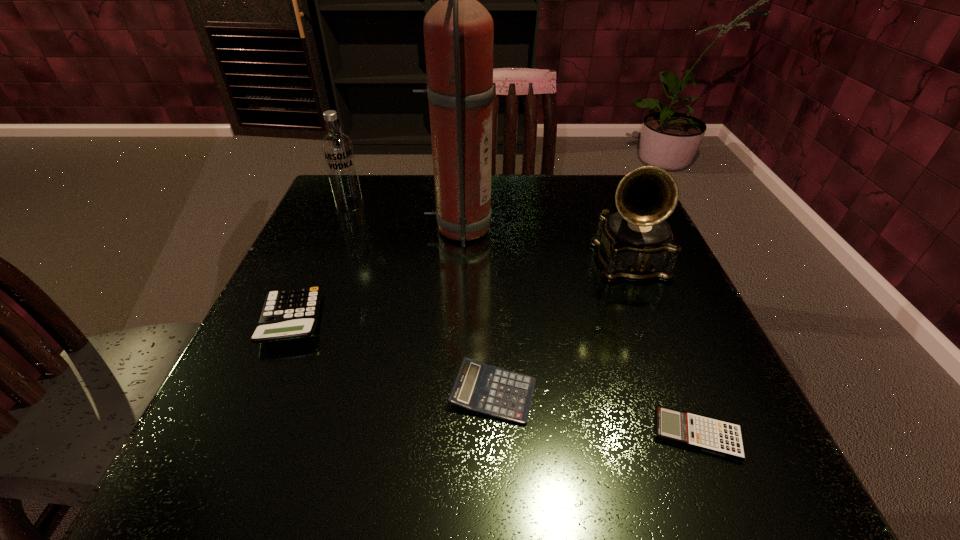
Find the location of a particular element. the closest object to the vodka is located at coordinates (458, 30).

You are a GUI agent. You are given a task and a screenshot of the screen. Output one action in this format:
    pyautogui.click(x=<x>, y=<y>)
    Task: Click on the third closest object to the fire extinguisher
    The height and width of the screenshot is (540, 960).
    Given the screenshot: What is the action you would take?
    pyautogui.click(x=636, y=243)

Identify which calculator is the second nearest to the phonograph record. Please provide its 2D coordinates. Your answer should be formatted as a tuple, i.e. [(x, y)], where the tuple contains the x and y coordinates of a point satisfying the conditions above.

[(721, 438)]

Find the location of a particular element. The width and height of the screenshot is (960, 540). calculator that is the second closest to the vodka is located at coordinates (478, 387).

The height and width of the screenshot is (540, 960). I want to click on free space that satisfies the following two spatial constraints: 1. on the front side of the shortest object; 2. on the left side of the second tallest calculator, so click(x=494, y=434).

Locate an element on the screen. vacant area that satisfies the following two spatial constraints: 1. on the side of the shortest object with the label and nozzle; 2. on the left side of the tallest object is located at coordinates (445, 434).

Find the location of a particular element. The image size is (960, 540). vacant area that satisfies the following two spatial constraints: 1. on the front label of the second calculator from right to left; 2. on the right side of the vodka is located at coordinates (271, 393).

Identify the location of free spot that satisfies the following two spatial constraints: 1. on the side of the fire extinguisher with the label and nozzle; 2. on the left side of the second shortest object. The width and height of the screenshot is (960, 540). (448, 393).